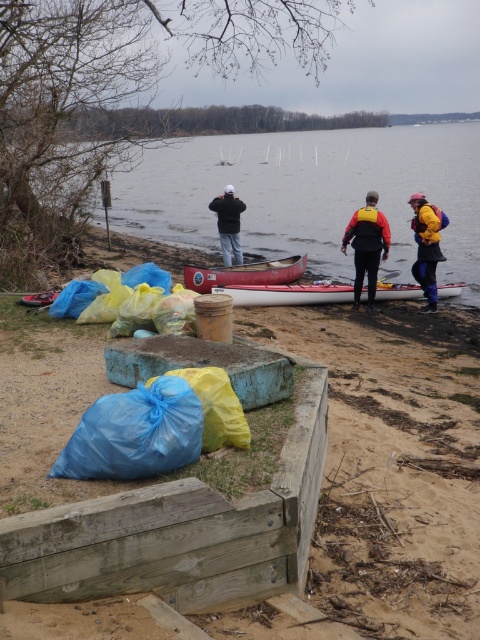
How distant is red-orange life vest at center from black matte jacket at center?

The distance of red-orange life vest at center from black matte jacket at center is 4.76 meters.

Who is lower down, red-orange life vest at center or black matte jacket at center?

Positioned lower is red-orange life vest at center.

The height and width of the screenshot is (640, 480). What are the coordinates of `red-orange life vest at center` in the screenshot? It's located at (367, 244).

What are the coordinates of `red-orange life vest at center` in the screenshot? It's located at (367, 244).

Which of these two, red-orange life vest at center or yellow waterproof jacket at right, stands shorter?

yellow waterproof jacket at right

The height and width of the screenshot is (640, 480). Identify the location of red-orange life vest at center. point(367,244).

What do you see at coordinates (367, 244) in the screenshot? I see `red-orange life vest at center` at bounding box center [367, 244].

This screenshot has width=480, height=640. Find the location of `red-orange life vest at center`. red-orange life vest at center is located at coordinates (367, 244).

Is white matte kayak at center to the left of red matte canoe at center from the viewer's perspective?

No, white matte kayak at center is not to the left of red matte canoe at center.

What do you see at coordinates (287, 292) in the screenshot? I see `white matte kayak at center` at bounding box center [287, 292].

Find the location of a particular element. This screenshot has height=640, width=480. white matte kayak at center is located at coordinates (287, 292).